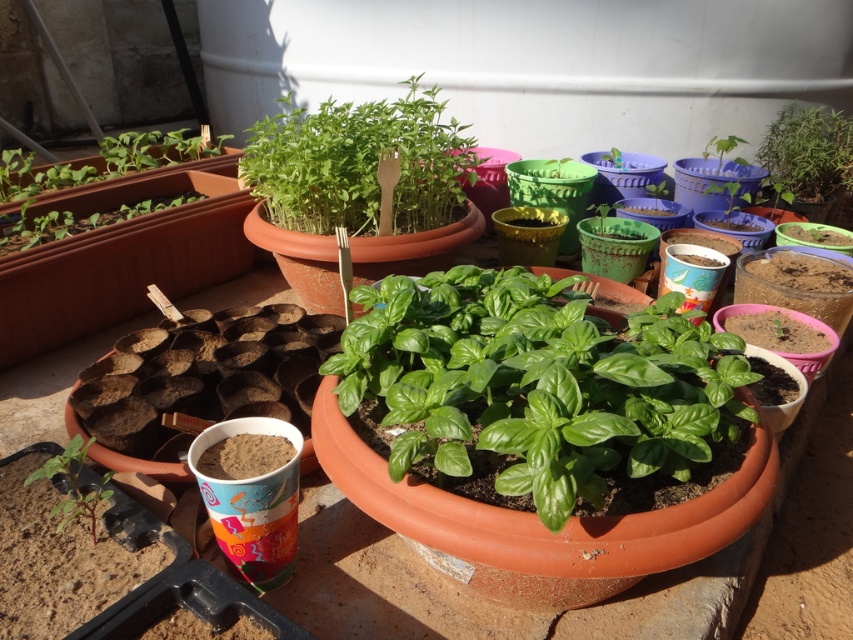
You are a gardener who wants to water the green glossy basil at center. You have a watering can that can reach 30 inches. Can you water it from where you are standing?

The distance between you and the green glossy basil at center is 31.33 inches, which is beyond the watering can reach of 30 inches. You need to move closer to water it.

You are a gardener who wants to plant a new flower in the garden. You have a small flower pot that can only accommodate plants with a width of 10 cm or less. Which of the two plants, the green glossy basil at center or the green matte plant at upper center, can you safely plant in your pot?

The green glossy basil at center has a width less than the green matte plant at upper center, so it can be safely planted in the small flower pot with a 10 cm width limit.